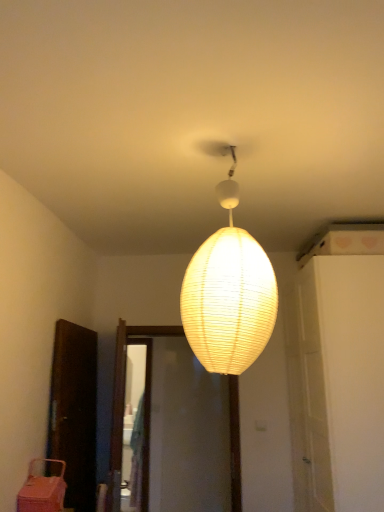
You are a GUI agent. You are given a task and a screenshot of the screen. Output one action in this format:
    pyautogui.click(x=<x>, y=<y>)
    Task: Click on the white matte door at center right
    The height and width of the screenshot is (512, 384).
    Given the screenshot: What is the action you would take?
    pyautogui.click(x=336, y=383)

How many degrees apart are the facing directions of ivory paper lampshade at center and white matte door at center right?

The angular difference between ivory paper lampshade at center and white matte door at center right is 87.9 degrees.

Considering the sizes of objects ivory paper lampshade at center and white matte door at center right in the image provided, who is smaller, ivory paper lampshade at center or white matte door at center right?

With smaller size is ivory paper lampshade at center.

Between point (273, 290) and point (367, 479), which one is positioned in front?

The point (273, 290) is in front.

From a real-world perspective, which is physically below, ivory paper lampshade at center or white matte door at center right?

In real-world perspective, white matte door at center right is lower.

Identify the location of furniture that appears below the ivory paper lampshade at center (from a real-world perspective). This screenshot has height=512, width=384. (42, 490).

Considering the sizes of pink plastic basket at lower left and ivory paper lampshade at center in the image, is pink plastic basket at lower left bigger or smaller than ivory paper lampshade at center?

Clearly, pink plastic basket at lower left is smaller in size than ivory paper lampshade at center.

Which point is more distant from viewer, (36, 507) or (244, 257)?

The point (36, 507) is behind.

Considering the sizes of objects white matte door at center right and ivory paper lampshade at center in the image provided, who is taller, white matte door at center right or ivory paper lampshade at center?

With more height is white matte door at center right.

Image resolution: width=384 pixels, height=512 pixels. What are the coordinates of `door on the right side of ivory paper lampshade at center` in the screenshot? It's located at (336, 383).

Between white matte door at center right and ivory paper lampshade at center, which one has smaller size?

ivory paper lampshade at center is smaller.

In the image, is white matte door at center right on the left side or the right side of ivory paper lampshade at center?

white matte door at center right is positioned on ivory paper lampshade at center's right side.

Based on the photo, can you see white matte door at center right touching pink plastic basket at lower left?

No.

The width and height of the screenshot is (384, 512). What are the coordinates of `door that is above the pink plastic basket at lower left (from a real-world perspective)` in the screenshot? It's located at (336, 383).

What's the angular difference between white matte door at center right and pink plastic basket at lower left's facing directions?

178 degrees separate the facing orientations of white matte door at center right and pink plastic basket at lower left.

Considering the relative positions of white matte door at center right and pink plastic basket at lower left in the image provided, is white matte door at center right to the left of pink plastic basket at lower left from the viewer's perspective?

No.

How far apart are pink plastic basket at lower left and white matte door at center right?

A distance of 1.54 meters exists between pink plastic basket at lower left and white matte door at center right.

Is pink plastic basket at lower left not close to white matte door at center right?

Yes, pink plastic basket at lower left and white matte door at center right are located far from each other.

Can you tell me how much pink plastic basket at lower left and white matte door at center right differ in facing direction?

pink plastic basket at lower left and white matte door at center right are facing 178 degrees away from each other.

Is pink plastic basket at lower left outside of white matte door at center right?

Indeed, pink plastic basket at lower left is completely outside white matte door at center right.

Is ivory paper lampshade at center oriented towards pink plastic basket at lower left?

No, ivory paper lampshade at center is not turned towards pink plastic basket at lower left.

Is there a large distance between ivory paper lampshade at center and pink plastic basket at lower left?

Yes, ivory paper lampshade at center and pink plastic basket at lower left are quite far apart.

From a real-world perspective, is ivory paper lampshade at center on pink plastic basket at lower left?

Yes.

Which is closer, [220,328] or [57,508]?

Clearly, point [220,328] is closer to the camera than point [57,508].

Identify the location of door that appears on the right of ivory paper lampshade at center. This screenshot has height=512, width=384. (336, 383).

The image size is (384, 512). Identify the location of furniture behind the ivory paper lampshade at center. (42, 490).

Based on their spatial positions, is pink plastic basket at lower left or ivory paper lampshade at center further from white matte door at center right?

pink plastic basket at lower left.

Estimate the real-world distances between objects in this image. Which object is further from ivory paper lampshade at center, white matte door at center right or pink plastic basket at lower left?

pink plastic basket at lower left is positioned further to the anchor ivory paper lampshade at center.

Looking at the image, which one is located further to ivory paper lampshade at center, pink plastic basket at lower left or white matte door at center right?

pink plastic basket at lower left is further to ivory paper lampshade at center.

Estimate the real-world distances between objects in this image. Which object is closer to pink plastic basket at lower left, white matte door at center right or ivory paper lampshade at center?

ivory paper lampshade at center is closer to pink plastic basket at lower left.

Looking at the image, which one is located further to pink plastic basket at lower left, ivory paper lampshade at center or white matte door at center right?

white matte door at center right lies further to pink plastic basket at lower left than the other object.

Looking at the image, which one is located further to white matte door at center right, ivory paper lampshade at center or pink plastic basket at lower left?

pink plastic basket at lower left lies further to white matte door at center right than the other object.

Where is `lamp between pink plastic basket at lower left and white matte door at center right in the horizontal direction`? The height and width of the screenshot is (512, 384). lamp between pink plastic basket at lower left and white matte door at center right in the horizontal direction is located at coordinates (228, 290).